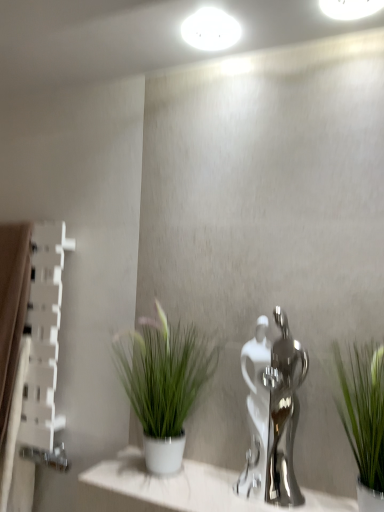
Question: Looking at their shapes, would you say brown fabric curtain at left is wider or thinner than white glossy ledge at center?

Choices:
 (A) thin
 (B) wide

Answer: (A)

Question: Is point (16, 424) positioned closer to the camera than point (162, 504)?

Choices:
 (A) farther
 (B) closer

Answer: (A)

Question: Which is farther from the white glossy ledge at center?

Choices:
 (A) white glossy light fixture at upper center, placed as the 2th lighting when sorted from front to back
 (B) white glossy light fixture at upper center, the second lighting when ordered from back to front
 (C) polished chrome faucet at center
 (D) green leafy plant at right, the first houseplant positioned from the right
 (E) green matte plant at center, the second houseplant positioned from the front

Answer: (B)

Question: Which object is positioned farthest from the white glossy ledge at center?

Choices:
 (A) polished chrome faucet at center
 (B) brown fabric curtain at left
 (C) white glossy light fixture at upper center, which is the 2th lighting in right-to-left order
 (D) white glossy light fixture at upper center, which is the 2th lighting from left to right
 (E) green matte plant at center, which is the 2th houseplant from right to left

Answer: (D)